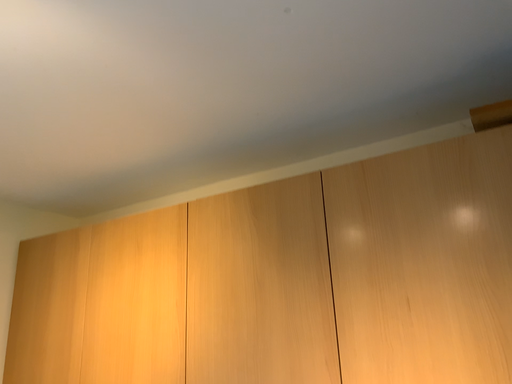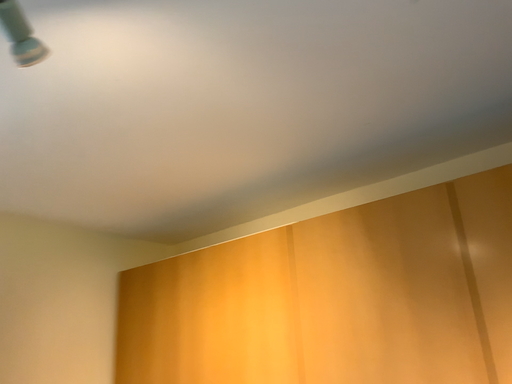
Question: How did the camera likely rotate when shooting the video?

Choices:
 (A) rotated right
 (B) rotated left

Answer: (B)